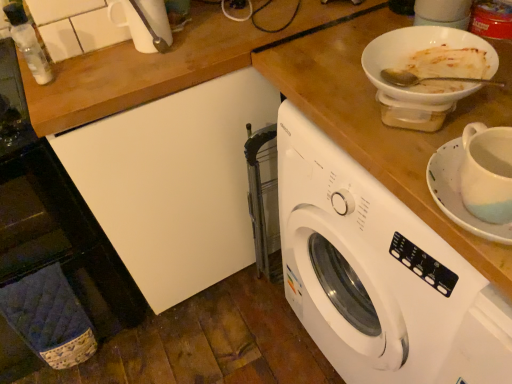
Question: Is white glossy bowl at upper right smaller than white plastic washing machine at center?

Choices:
 (A) no
 (B) yes

Answer: (B)

Question: From the image's perspective, is white glossy bowl at upper right over white plastic washing machine at center?

Choices:
 (A) no
 (B) yes

Answer: (B)

Question: Is white glossy bowl at upper right positioned with its back to white plastic washing machine at center?

Choices:
 (A) no
 (B) yes

Answer: (A)

Question: Is white glossy bowl at upper right at the left side of white plastic washing machine at center?

Choices:
 (A) yes
 (B) no

Answer: (A)

Question: Is white glossy bowl at upper right with white plastic washing machine at center?

Choices:
 (A) no
 (B) yes

Answer: (A)

Question: From a real-world perspective, is white glossy bowl at upper right physically below white plastic washing machine at center?

Choices:
 (A) no
 (B) yes

Answer: (A)

Question: Are white plastic washing machine at center and transparent plastic bottle at upper left beside each other?

Choices:
 (A) no
 (B) yes

Answer: (A)

Question: Is white plastic washing machine at center taller than transparent plastic bottle at upper left?

Choices:
 (A) yes
 (B) no

Answer: (A)

Question: Is transparent plastic bottle at upper left at the back of white plastic washing machine at center?

Choices:
 (A) yes
 (B) no

Answer: (B)

Question: From a real-world perspective, is white plastic washing machine at center on top of transparent plastic bottle at upper left?

Choices:
 (A) no
 (B) yes

Answer: (A)

Question: Would you say white plastic washing machine at center is outside transparent plastic bottle at upper left?

Choices:
 (A) yes
 (B) no

Answer: (A)

Question: Can you confirm if white plastic washing machine at center is smaller than transparent plastic bottle at upper left?

Choices:
 (A) yes
 (B) no

Answer: (B)

Question: From a real-world perspective, is white ceramic saucer at right on top of white plastic washing machine at center?

Choices:
 (A) no
 (B) yes

Answer: (B)